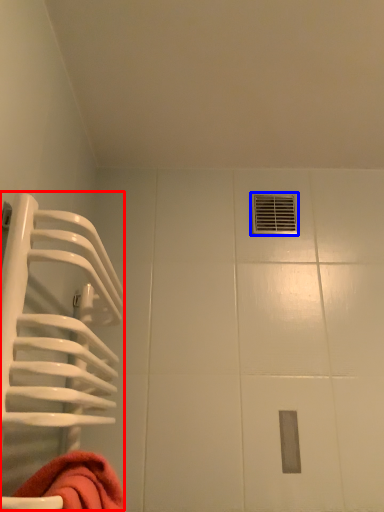
Question: Which point is further to the camera, cage (highlighted by a red box) or hole (highlighted by a blue box)?

Choices:
 (A) cage
 (B) hole

Answer: (B)